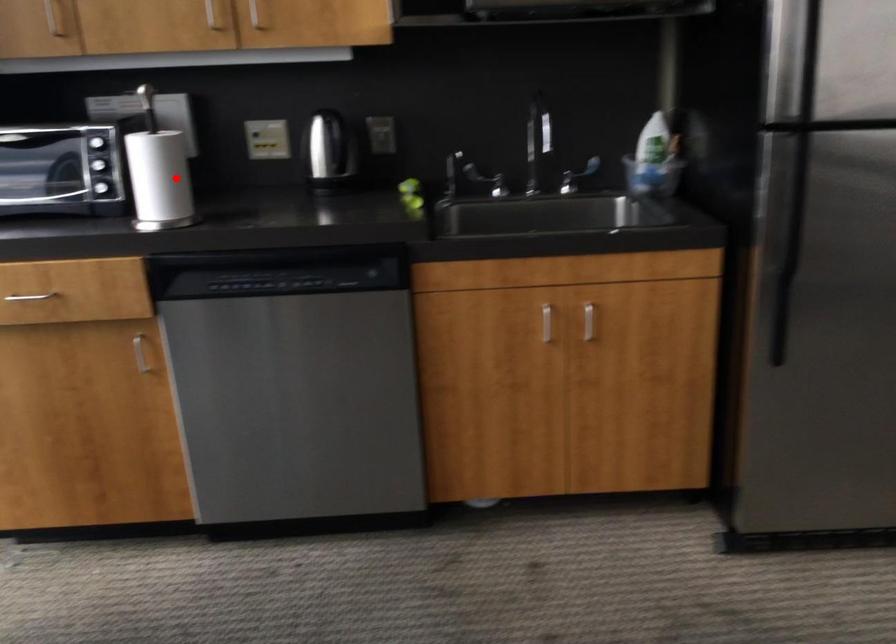
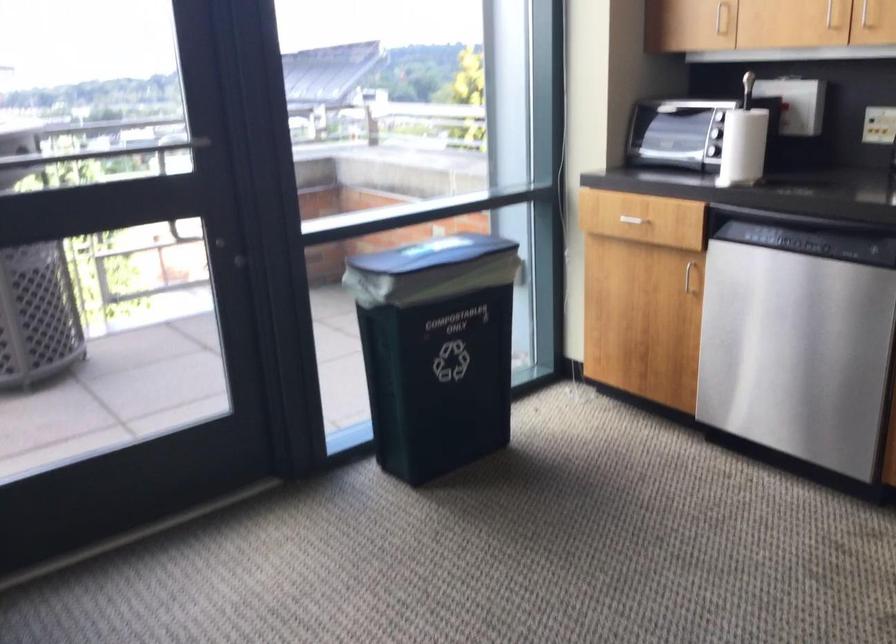
Locate, in the second image, the point that corresponds to the highlighted location in the first image.

(743, 146)